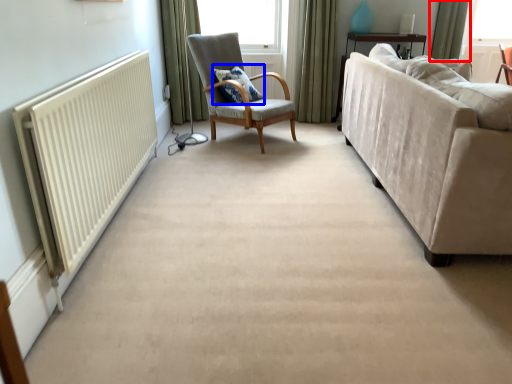
Question: Which object appears farthest to the camera in this image, curtain (highlighted by a red box) or pillow (highlighted by a blue box)?

Choices:
 (A) curtain
 (B) pillow

Answer: (A)